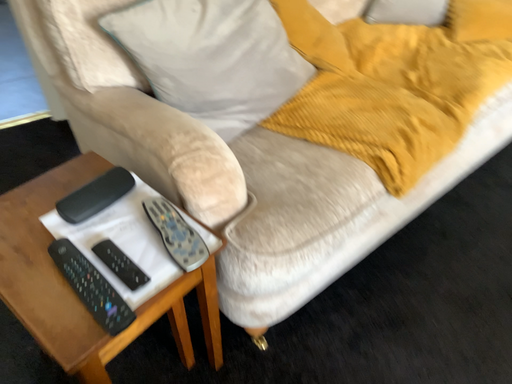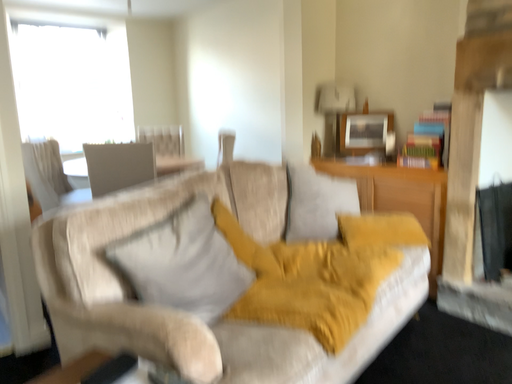
Question: Which way did the camera rotate in the video?

Choices:
 (A) rotated right
 (B) rotated left

Answer: (A)